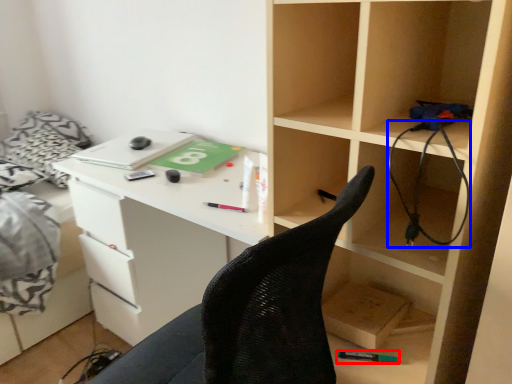
Question: Which of the following is the farthest to the observer, stationery (highlighted by a red box) or wire (highlighted by a blue box)?

Choices:
 (A) stationery
 (B) wire

Answer: (A)